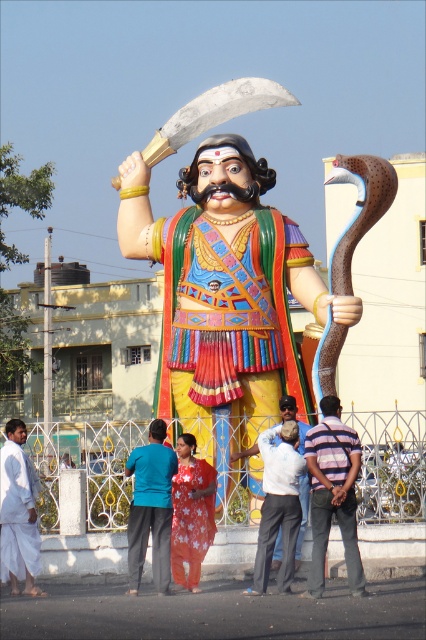
Question: Is white cloth at lower left thinner than white cotton shirt at center?

Choices:
 (A) no
 (B) yes

Answer: (B)

Question: Is floral fabric saree at center positioned in front of shiny silver blade at upper center?

Choices:
 (A) no
 (B) yes

Answer: (B)

Question: Among these objects, which one is nearest to the camera?

Choices:
 (A) striped fabric shirt at center
 (B) floral fabric saree at center

Answer: (A)

Question: Which of the following is the closest to the observer?

Choices:
 (A) (330, 502)
 (B) (219, 97)
 (C) (6, 547)
 (D) (158, 452)

Answer: (A)

Question: Which point appears farthest from the camera in this image?

Choices:
 (A) 169,496
 (B) 17,550
 (C) 259,77
 (D) 305,452

Answer: (C)

Question: Where is blue fabric pants at center located in relation to shiny silver blade at upper center in the image?

Choices:
 (A) right
 (B) left

Answer: (B)